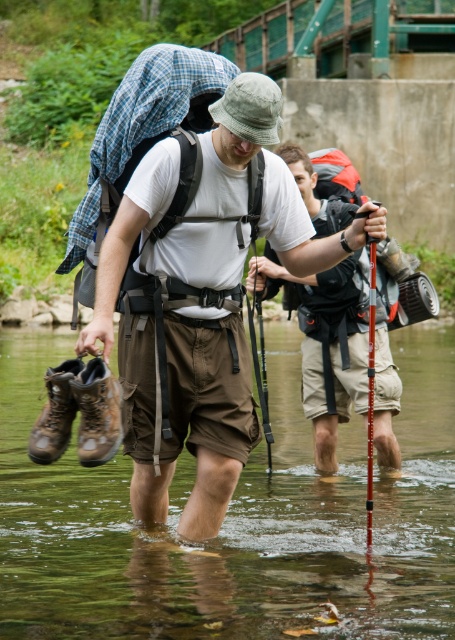
Question: Does matte khaki shorts at center appear on the left side of brown leather boot at lower left?

Choices:
 (A) yes
 (B) no

Answer: (B)

Question: Which point is farther to the camera?

Choices:
 (A) matte khaki shorts at center
 (B) brown leather boot at lower left

Answer: (A)

Question: Estimate the real-world distances between objects in this image. Which object is closer to the brown leather boot at lower left?

Choices:
 (A) brown suede boot at lower left
 (B) brown canvas backpack at center
 (C) clear water at lower center

Answer: (A)

Question: Does clear water at lower center appear under brown suede boot at lower left?

Choices:
 (A) no
 (B) yes

Answer: (B)

Question: Is brown canvas backpack at center to the right of brown suede boot at lower left from the viewer's perspective?

Choices:
 (A) no
 (B) yes

Answer: (B)

Question: Which of the following is the closest to the observer?

Choices:
 (A) (60, 451)
 (B) (340, 360)
 (C) (84, 424)

Answer: (C)